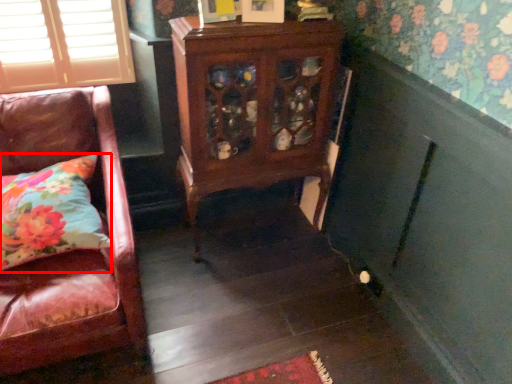
Question: From the image's perspective, where is pillow (annotated by the red box) located relative to furniture?

Choices:
 (A) above
 (B) below

Answer: (B)